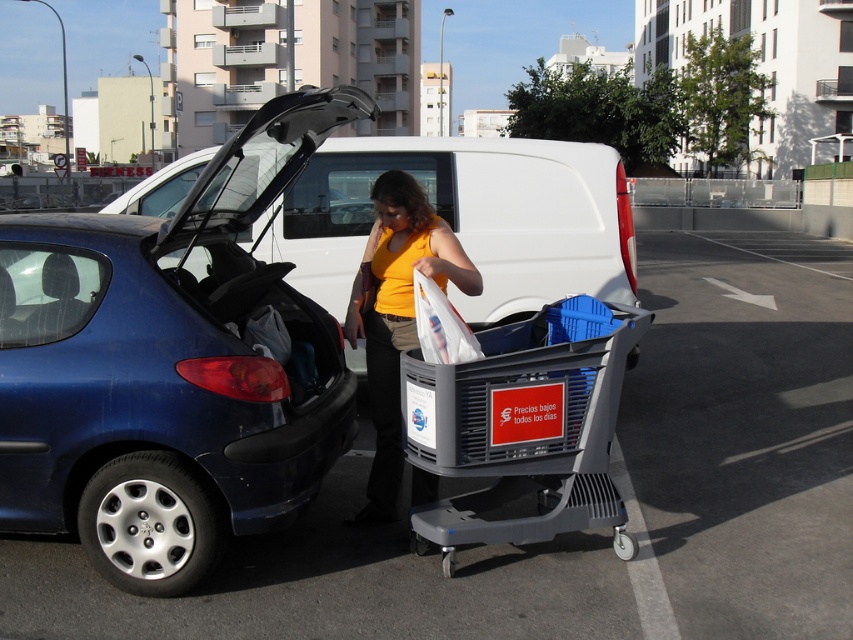
The image size is (853, 640). I want to click on smooth gray shopping cart at center, so click(x=578, y=532).

Measure the distance between point [660,394] and camera.

Point [660,394] is 25.74 feet from camera.

The width and height of the screenshot is (853, 640). Find the location of `smooth gray shopping cart at center`. smooth gray shopping cart at center is located at coordinates point(578,532).

Find the location of `smooth gray shopping cart at center`. smooth gray shopping cart at center is located at coordinates pos(578,532).

Does point (350, 611) lie behind point (468, 429)?

That is False.

Which is behind, point (607, 625) or point (595, 417)?

The point (595, 417) is more distant.

Locate an element on the screen. This screenshot has height=640, width=853. smooth gray shopping cart at center is located at coordinates click(x=578, y=532).

Between white matte van at center and yellow matte shirt at center, which one is positioned lower?

yellow matte shirt at center is below.

Does point (479, 182) come closer to viewer compared to point (358, 282)?

That is False.

Locate an element on the screen. white matte van at center is located at coordinates (468, 218).